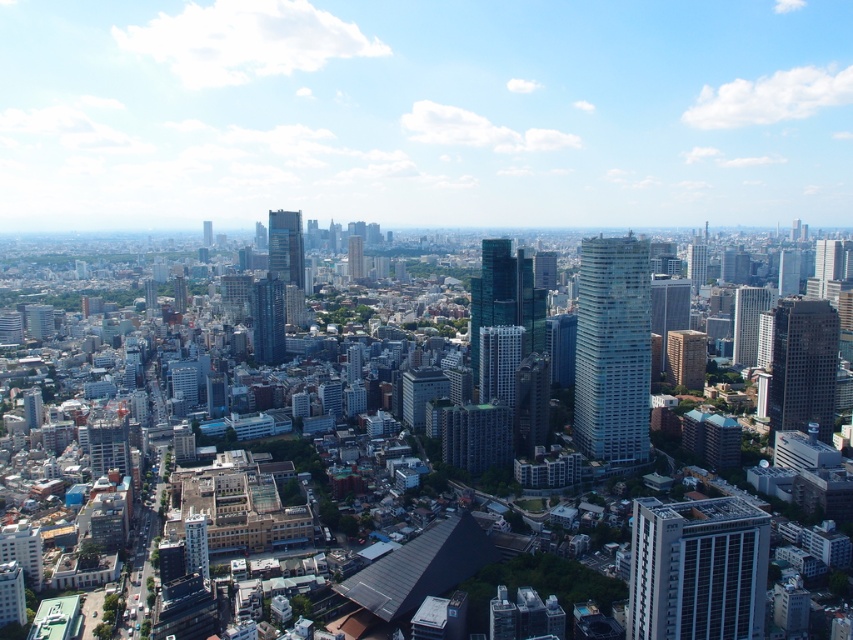
You are standing at the point labeled as point (x=630, y=449) in the city. A drone needs to deliver a package to you. The drone has a maximum delivery range of 200 meters. Can the drone reach you?

The distance between point (x=630, y=449) and the viewer is 242.85 meters, which exceeds the drone delivery range of 200 meters. The drone cannot reach you.

You are a city planner analyzing the urban layout. Given the white glass building at center and the dark blue glass skyscraper at center, which one has a narrower width?

The white glass building at center has a narrower width compared to the dark blue glass skyscraper at center as stated in the description.